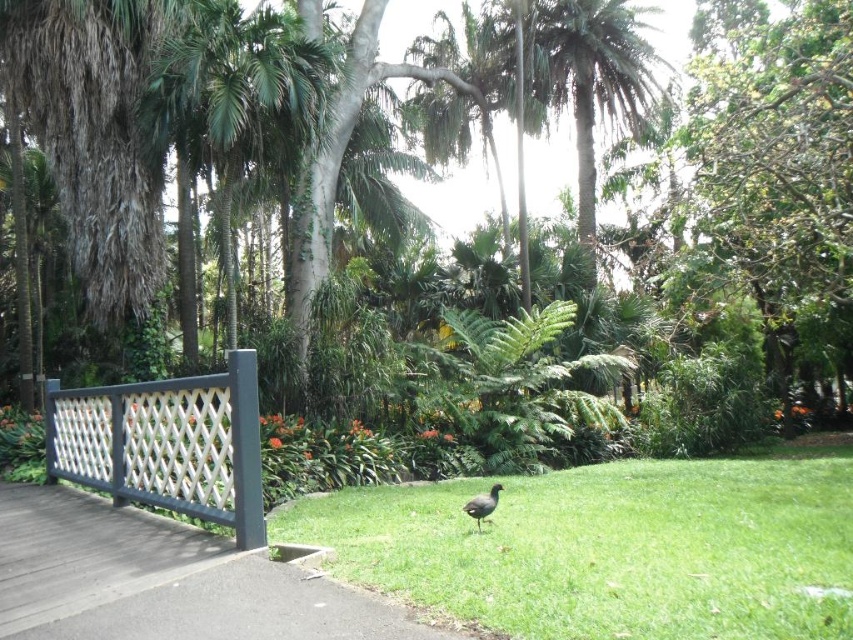
Question: Observing the image, what is the correct spatial positioning of white lattice fence at left in reference to brown matte bird at center?

Choices:
 (A) above
 (B) below

Answer: (A)

Question: Which point is farther to the camera?

Choices:
 (A) (476, 524)
 (B) (582, 474)

Answer: (B)

Question: Can you confirm if white lattice fence at left is positioned below brown matte bird at center?

Choices:
 (A) no
 (B) yes

Answer: (A)

Question: Which object appears closest to the camera in this image?

Choices:
 (A) white lattice fence at left
 (B) green grass at center

Answer: (B)

Question: Which object appears farthest from the camera in this image?

Choices:
 (A) white lattice fence at left
 (B) green grass at center
 (C) brown matte bird at center

Answer: (C)

Question: From the image, what is the correct spatial relationship of white lattice fence at left in relation to brown matte bird at center?

Choices:
 (A) right
 (B) left

Answer: (B)